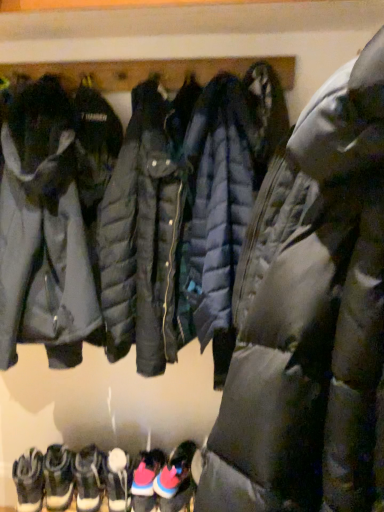
What is the approximate width of pink suede sneakers at lower center, which appears as the 1th footwear when viewed from the right?

The width of pink suede sneakers at lower center, which appears as the 1th footwear when viewed from the right, is 11.39 inches.

The width and height of the screenshot is (384, 512). What do you see at coordinates (58, 478) in the screenshot?
I see `white suede boots at lower left, the fifth footwear when ordered from right to left` at bounding box center [58, 478].

At what (x,y) coordinates should I click in order to perform the action: click on matte black jacket at left, positioned as the 1th jacket in left-to-right order. Please return your answer as a coordinate pair (x, y). The width and height of the screenshot is (384, 512). Looking at the image, I should click on (43, 231).

The image size is (384, 512). What do you see at coordinates (310, 317) in the screenshot?
I see `matte black puffer jacket at center, which ranks as the second jacket in left-to-right order` at bounding box center [310, 317].

Locate an element on the screen. This screenshot has width=384, height=512. white fuzzy socks at lower left, the first footwear positioned from the left is located at coordinates (29, 481).

Locate an element on the screen. The width and height of the screenshot is (384, 512). pink suede sneakers at lower center, which appears as the 1th footwear when viewed from the right is located at coordinates (176, 479).

Between white suede boots at lower left, the 2th footwear in the left-to-right sequence, and matte black puffer jacket at center, which one has smaller width?

white suede boots at lower left, the 2th footwear in the left-to-right sequence.

Is matte black puffer jacket at center at the back of white suede boots at lower left, the 2th footwear in the left-to-right sequence?

No, white suede boots at lower left, the 2th footwear in the left-to-right sequence, is not facing away from matte black puffer jacket at center.

Is white suede boots at lower left, the 2th footwear in the left-to-right sequence, inside or outside of matte black puffer jacket at center?

white suede boots at lower left, the 2th footwear in the left-to-right sequence, is located beyond the bounds of matte black puffer jacket at center.

How different are the orientations of white suede boots at lower left, the 2th footwear in the left-to-right sequence, and matte black puffer jacket at center in degrees?

They differ by 7.63 degrees in their facing directions.

From the image's perspective, would you say white leather sneakers at lower left, arranged as the 4th footwear when viewed from the right, is shown under white suede boot at lower center, which is the 3th footwear in right-to-left order?

Yes.

Is point (88, 502) more distant than point (126, 494)?

No, it is in front of (126, 494).

Does white leather sneakers at lower left, arranged as the 4th footwear when viewed from the right, turn towards white suede boot at lower center, which is the 3th footwear in right-to-left order?

No, white leather sneakers at lower left, arranged as the 4th footwear when viewed from the right, is not turned towards white suede boot at lower center, which is the 3th footwear in right-to-left order.

How different are the orientations of white suede boots at lower left, the 2th footwear in the left-to-right sequence, and white fuzzy socks at lower left, which is counted as the 6th footwear, starting from the right, in degrees?

There is a 0-degree angle between the facing directions of white suede boots at lower left, the 2th footwear in the left-to-right sequence, and white fuzzy socks at lower left, which is counted as the 6th footwear, starting from the right.

How distant is white suede boots at lower left, the 2th footwear in the left-to-right sequence, from white fuzzy socks at lower left, which is counted as the 6th footwear, starting from the right?

2.20 inches.

From a real-world perspective, between white suede boots at lower left, the 2th footwear in the left-to-right sequence, and white fuzzy socks at lower left, the first footwear positioned from the left, who is vertically lower?

In real-world perspective, white suede boots at lower left, the 2th footwear in the left-to-right sequence, is lower.

Considering the positions of objects white suede boots at lower left, the fifth footwear when ordered from right to left, and white fuzzy socks at lower left, which is counted as the 6th footwear, starting from the right, in the image provided, who is more to the right, white suede boots at lower left, the fifth footwear when ordered from right to left, or white fuzzy socks at lower left, which is counted as the 6th footwear, starting from the right,?

white suede boots at lower left, the fifth footwear when ordered from right to left, is more to the right.

Is matte black puffer jacket at center, which appears as the first jacket when viewed from the right, positioned beyond the bounds of matte black jacket at left, the second jacket from the right?

Absolutely, matte black puffer jacket at center, which appears as the first jacket when viewed from the right, is external to matte black jacket at left, the second jacket from the right.

Is matte black puffer jacket at center, arranged as the 1th jacket when viewed from the front, beside matte black jacket at left, the second jacket from the right?

matte black puffer jacket at center, arranged as the 1th jacket when viewed from the front, and matte black jacket at left, the second jacket from the right, are not in contact.

Does matte black puffer jacket at center, which appears as the second jacket when viewed from the back, come behind matte black jacket at left, the second jacket when ordered from front to back?

No, it is in front of matte black jacket at left, the second jacket when ordered from front to back.

Is pink suede sneakers at lower center, the second footwear viewed from the right, taller than matte black jacket at left, the first jacket in the back-to-front sequence?

No, pink suede sneakers at lower center, the second footwear viewed from the right, is not taller than matte black jacket at left, the first jacket in the back-to-front sequence.

How much distance is there between pink suede sneakers at lower center, the second footwear viewed from the right, and matte black jacket at left, the first jacket in the back-to-front sequence?

pink suede sneakers at lower center, the second footwear viewed from the right, is 34.95 inches from matte black jacket at left, the first jacket in the back-to-front sequence.

Does pink suede sneakers at lower center, the fifth footwear positioned from the left, turn towards matte black jacket at left, the second jacket when ordered from front to back?

No, pink suede sneakers at lower center, the fifth footwear positioned from the left, is not oriented towards matte black jacket at left, the second jacket when ordered from front to back.

Looking at this image, does pink suede sneakers at lower center, the second footwear viewed from the right, appear on the right side of matte black jacket at left, positioned as the 1th jacket in left-to-right order?

Correct, you'll find pink suede sneakers at lower center, the second footwear viewed from the right, to the right of matte black jacket at left, positioned as the 1th jacket in left-to-right order.

Is point (39, 472) positioned before point (178, 496)?

No, it is behind (178, 496).

Is white fuzzy socks at lower left, which is counted as the 6th footwear, starting from the right, bigger or smaller than pink suede sneakers at lower center, the sixth footwear from the left?

white fuzzy socks at lower left, which is counted as the 6th footwear, starting from the right, is smaller than pink suede sneakers at lower center, the sixth footwear from the left.

Is white fuzzy socks at lower left, the first footwear positioned from the left, turned away from pink suede sneakers at lower center, the sixth footwear from the left?

No, white fuzzy socks at lower left, the first footwear positioned from the left, is not facing the opposite direction of pink suede sneakers at lower center, the sixth footwear from the left.

Can you confirm if white fuzzy socks at lower left, the first footwear positioned from the left, is wider than pink suede sneakers at lower center, which appears as the 1th footwear when viewed from the right?

Incorrect, the width of white fuzzy socks at lower left, the first footwear positioned from the left, does not surpass that of pink suede sneakers at lower center, which appears as the 1th footwear when viewed from the right.

Is white suede boot at lower center, positioned as the fourth footwear in left-to-right order, aimed at matte black puffer jacket at center, which appears as the first jacket when viewed from the right?

No, white suede boot at lower center, positioned as the fourth footwear in left-to-right order, is not facing towards matte black puffer jacket at center, which appears as the first jacket when viewed from the right.

What's the angular difference between white suede boot at lower center, positioned as the fourth footwear in left-to-right order, and matte black puffer jacket at center, which appears as the first jacket when viewed from the right,'s facing directions?

white suede boot at lower center, positioned as the fourth footwear in left-to-right order, and matte black puffer jacket at center, which appears as the first jacket when viewed from the right, are facing 101 degrees away from each other.

From the image's perspective, is white suede boot at lower center, positioned as the fourth footwear in left-to-right order, located beneath matte black puffer jacket at center, which appears as the first jacket when viewed from the right?

Indeed, from the image's perspective, white suede boot at lower center, positioned as the fourth footwear in left-to-right order, is shown beneath matte black puffer jacket at center, which appears as the first jacket when viewed from the right.

From a real-world perspective, does white suede boot at lower center, which is the 3th footwear in right-to-left order, stand above matte black puffer jacket at center, which appears as the second jacket when viewed from the back?

No.

From the image's perspective, starting from the matte black puffer jacket at center, which footwear is the 3rd one below? Please provide its 2D coordinates.

[(58, 478)]

I want to click on the 2nd footwear in front of the white leather sneakers at lower left, which ranks as the 3th footwear in left-to-right order, counting from the anchor's position, so click(118, 480).

From the image, which object appears to be nearer to matte black puffer jacket at center, white suede boot at lower center, positioned as the fourth footwear in left-to-right order, or pink suede sneakers at lower center, the fifth footwear positioned from the left?

Based on the image, white suede boot at lower center, positioned as the fourth footwear in left-to-right order, appears to be nearer to matte black puffer jacket at center.

When comparing their distances from matte black puffer jacket at center, does pink suede sneakers at lower center, which appears as the 1th footwear when viewed from the right, or white suede boots at lower left, the 2th footwear in the left-to-right sequence, seem closer?

pink suede sneakers at lower center, which appears as the 1th footwear when viewed from the right.

In the scene shown: Based on their spatial positions, is matte black puffer jacket at center, which appears as the first jacket when viewed from the right, or pink suede sneakers at lower center, which appears as the 1th footwear when viewed from the right, further from white suede boot at lower center, which is the 3th footwear in right-to-left order?

matte black puffer jacket at center, which appears as the first jacket when viewed from the right.

Estimate the real-world distances between objects in this image. Which object is closer to white suede boots at lower left, the 2th footwear in the left-to-right sequence, pink suede sneakers at lower center, which appears as the 1th footwear when viewed from the right, or matte black puffer jacket at center, which appears as the second jacket when viewed from the back?

Among the two, pink suede sneakers at lower center, which appears as the 1th footwear when viewed from the right, is located nearer to white suede boots at lower left, the 2th footwear in the left-to-right sequence.

Estimate the real-world distances between objects in this image. Which object is closer to white leather sneakers at lower left, arranged as the 4th footwear when viewed from the right, pink suede sneakers at lower center, which appears as the 1th footwear when viewed from the right, or white fuzzy socks at lower left, which is counted as the 6th footwear, starting from the right?

white fuzzy socks at lower left, which is counted as the 6th footwear, starting from the right, lies closer to white leather sneakers at lower left, arranged as the 4th footwear when viewed from the right, than the other object.

Which object lies nearer to the anchor point matte black puffer jacket at center, white suede boot at lower center, which is the 3th footwear in right-to-left order, or matte black puffer jacket at center, which appears as the first jacket when viewed from the right?

matte black puffer jacket at center, which appears as the first jacket when viewed from the right, is closer to matte black puffer jacket at center.

Looking at the image, which one is located further to matte black jacket at left, positioned as the 1th jacket in left-to-right order, matte black puffer jacket at center, which appears as the second jacket when viewed from the back, or pink suede sneakers at lower center, the fifth footwear positioned from the left?

Among the two, pink suede sneakers at lower center, the fifth footwear positioned from the left, is located further to matte black jacket at left, positioned as the 1th jacket in left-to-right order.

From the image, which object appears to be farther from pink suede sneakers at lower center, the sixth footwear from the left, matte black puffer jacket at center or white suede boot at lower center, which is the 3th footwear in right-to-left order?

matte black puffer jacket at center is positioned further to the anchor pink suede sneakers at lower center, the sixth footwear from the left.

You are a GUI agent. You are given a task and a screenshot of the screen. Output one action in this format:
    pyautogui.click(x=<x>, y=<y>)
    Task: Click on the sweatshirt located between matte black puffer jacket at center, which appears as the second jacket when viewed from the back, and pink suede sneakers at lower center, the second footwear viewed from the right, in the depth direction
    This screenshot has height=512, width=384.
    Given the screenshot: What is the action you would take?
    click(130, 216)

This screenshot has height=512, width=384. I want to click on footwear between white leather sneakers at lower left, which ranks as the 3th footwear in left-to-right order, and pink suede sneakers at lower center, the fifth footwear positioned from the left, so click(x=118, y=480).

Locate an element on the screen. The width and height of the screenshot is (384, 512). sweatshirt between matte black jacket at left, the second jacket from the right, and pink suede sneakers at lower center, the second footwear viewed from the right, vertically is located at coordinates (130, 216).

At what (x,y) coordinates should I click in order to perform the action: click on footwear between white suede boots at lower left, the 2th footwear in the left-to-right sequence, and white suede boot at lower center, positioned as the fourth footwear in left-to-right order. Please return your answer as a coordinate pair (x, y). The image size is (384, 512). Looking at the image, I should click on (88, 478).